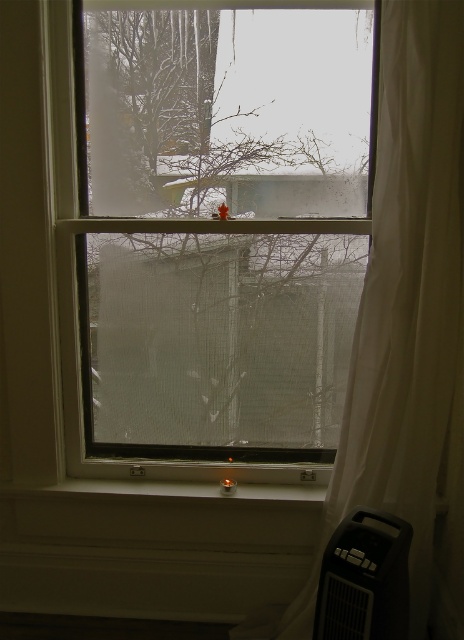
You are trying to place a rectangular picture frame that is 30 inches wide on the wall between the clear glass window at center and the black plastic air conditioner at lower right. Based on the spacing between them, will the picture frame fit?

The clear glass window at center and the black plastic air conditioner at lower right are 29.42 inches apart. Since the picture frame is 30 inches wide, it will not fit between them as the distance is slightly less than the frame width.

You are planning to hang a small hook on the wall near the white sheer curtain at right and the black plastic air conditioner at lower right. Based on their positions, where should the hook be placed to ensure it is between them?

The white sheer curtain at right is above the black plastic air conditioner at lower right, so the hook should be placed between them vertically, above the air conditioner and below the curtain.